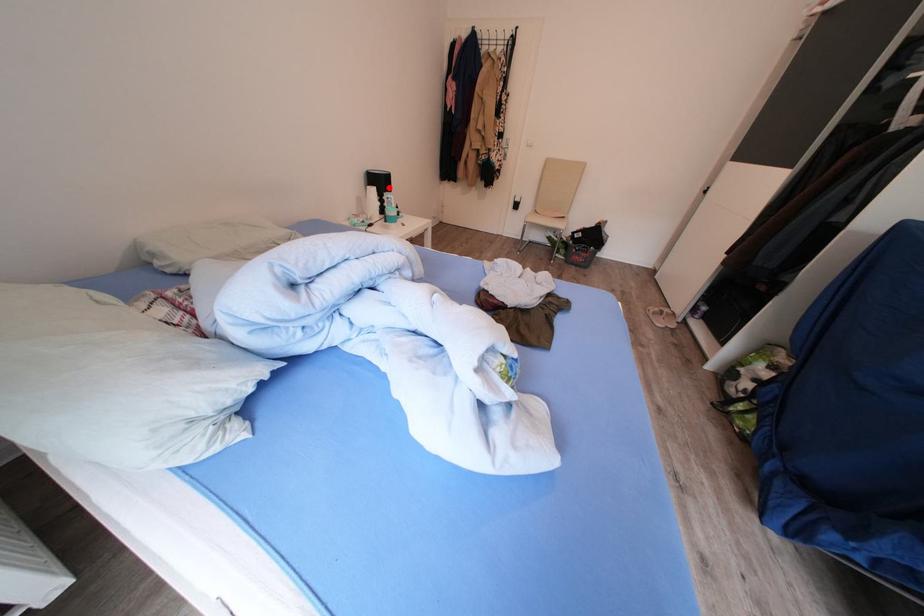
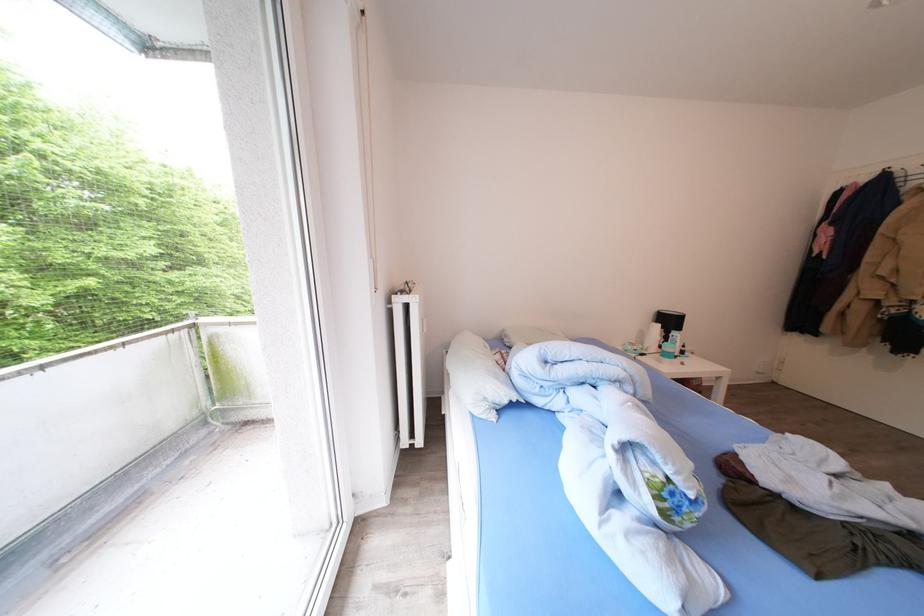
Where in the second image is the point corresponding to the highlighted location from the first image?

(677, 326)